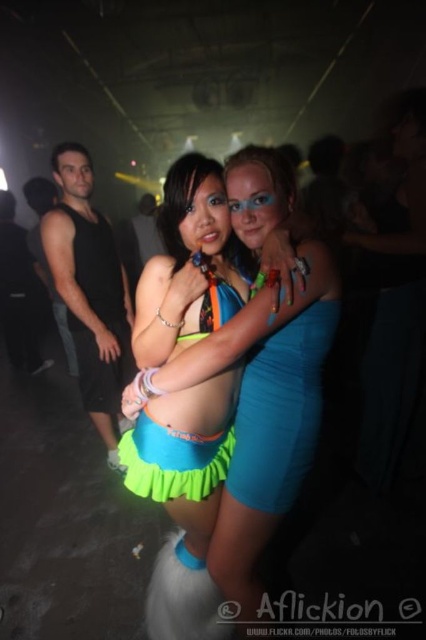
Question: Among these points, which one is farthest from the camera?

Choices:
 (A) (230, 442)
 (B) (267, 486)

Answer: (A)

Question: Is neon green fabric skirt at center closer to camera compared to neon blue fabric dress at center?

Choices:
 (A) yes
 (B) no

Answer: (A)

Question: Is neon green fabric skirt at center to the left of neon blue fabric dress at center from the viewer's perspective?

Choices:
 (A) yes
 (B) no

Answer: (B)

Question: Which of the following is the closest to the observer?

Choices:
 (A) neon blue fabric dress at center
 (B) neon green fabric skirt at center

Answer: (B)

Question: Does neon green fabric skirt at center have a lesser width compared to neon blue fabric dress at center?

Choices:
 (A) yes
 (B) no

Answer: (B)

Question: Which of the following is the farthest from the observer?

Choices:
 (A) neon blue fabric dress at center
 (B) neon green fabric skirt at center

Answer: (A)